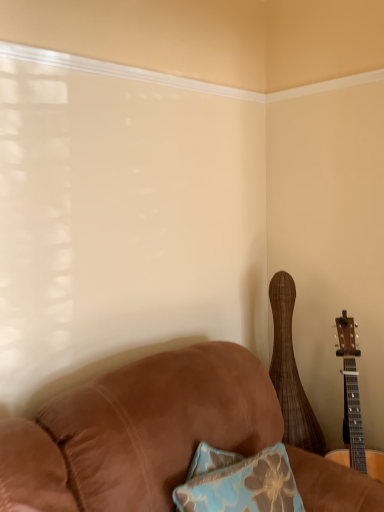
Question: Should I look upward or downward to see wooden acoustic guitar at right, which appears as the first guitar when viewed from the left?

Choices:
 (A) down
 (B) up

Answer: (A)

Question: Is the surface of wooden acoustic guitar at right, which is the second guitar from right to left, in direct contact with natural wood acoustic guitar at right, positioned as the 2th guitar in left-to-right order?

Choices:
 (A) yes
 (B) no

Answer: (B)

Question: Is wooden acoustic guitar at right, which is the second guitar from right to left, shorter than natural wood acoustic guitar at right, marked as the 1th guitar in a right-to-left arrangement?

Choices:
 (A) yes
 (B) no

Answer: (B)

Question: From a real-world perspective, does wooden acoustic guitar at right, which is the second guitar from right to left, sit lower than natural wood acoustic guitar at right, positioned as the 2th guitar in left-to-right order?

Choices:
 (A) no
 (B) yes

Answer: (A)

Question: From the image's perspective, is wooden acoustic guitar at right, which appears as the first guitar when viewed from the left, located above natural wood acoustic guitar at right, positioned as the 2th guitar in left-to-right order?

Choices:
 (A) yes
 (B) no

Answer: (A)

Question: Could you tell me if wooden acoustic guitar at right, which is the second guitar from right to left, is facing natural wood acoustic guitar at right, marked as the 1th guitar in a right-to-left arrangement?

Choices:
 (A) yes
 (B) no

Answer: (A)

Question: Is wooden acoustic guitar at right, which appears as the first guitar when viewed from the left, facing away from natural wood acoustic guitar at right, positioned as the 2th guitar in left-to-right order?

Choices:
 (A) yes
 (B) no

Answer: (A)

Question: Is natural wood acoustic guitar at right, marked as the 1th guitar in a right-to-left arrangement, smaller than wooden acoustic guitar at right, which appears as the first guitar when viewed from the left?

Choices:
 (A) no
 (B) yes

Answer: (A)

Question: Could wooden acoustic guitar at right, which appears as the first guitar when viewed from the left, be considered to be inside natural wood acoustic guitar at right, positioned as the 2th guitar in left-to-right order?

Choices:
 (A) yes
 (B) no

Answer: (B)

Question: Is natural wood acoustic guitar at right, marked as the 1th guitar in a right-to-left arrangement, placed right next to wooden acoustic guitar at right, which is the second guitar from right to left?

Choices:
 (A) no
 (B) yes

Answer: (A)

Question: Is natural wood acoustic guitar at right, positioned as the 2th guitar in left-to-right order, positioned before wooden acoustic guitar at right, which is the second guitar from right to left?

Choices:
 (A) no
 (B) yes

Answer: (B)

Question: Is natural wood acoustic guitar at right, positioned as the 2th guitar in left-to-right order, positioned with its back to wooden acoustic guitar at right, which appears as the first guitar when viewed from the left?

Choices:
 (A) yes
 (B) no

Answer: (A)

Question: From a real-world perspective, is natural wood acoustic guitar at right, positioned as the 2th guitar in left-to-right order, located higher than wooden acoustic guitar at right, which appears as the first guitar when viewed from the left?

Choices:
 (A) no
 (B) yes

Answer: (A)

Question: From a real-world perspective, relative to natural wood acoustic guitar at right, positioned as the 2th guitar in left-to-right order, is wooden acoustic guitar at right, which is the second guitar from right to left, vertically above or below?

Choices:
 (A) below
 (B) above

Answer: (B)